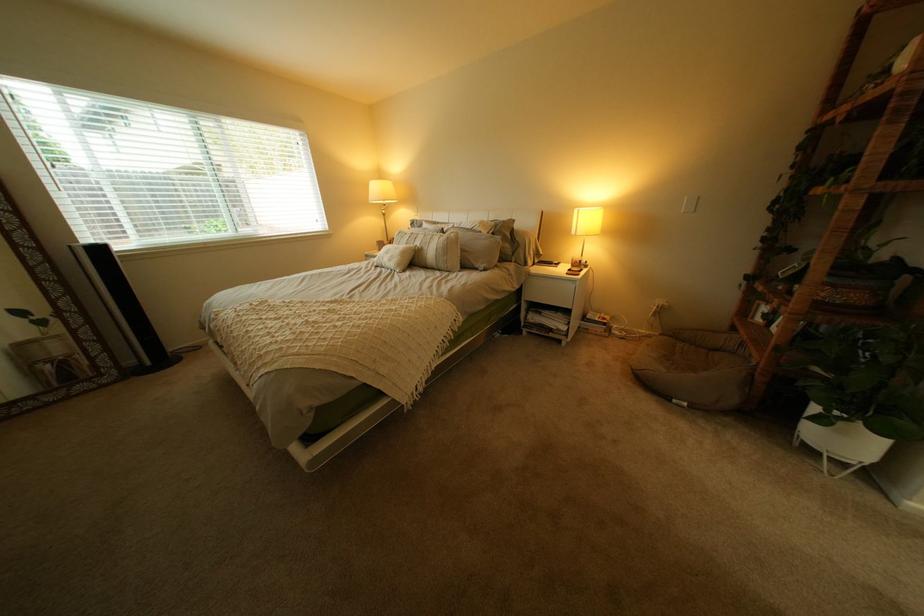
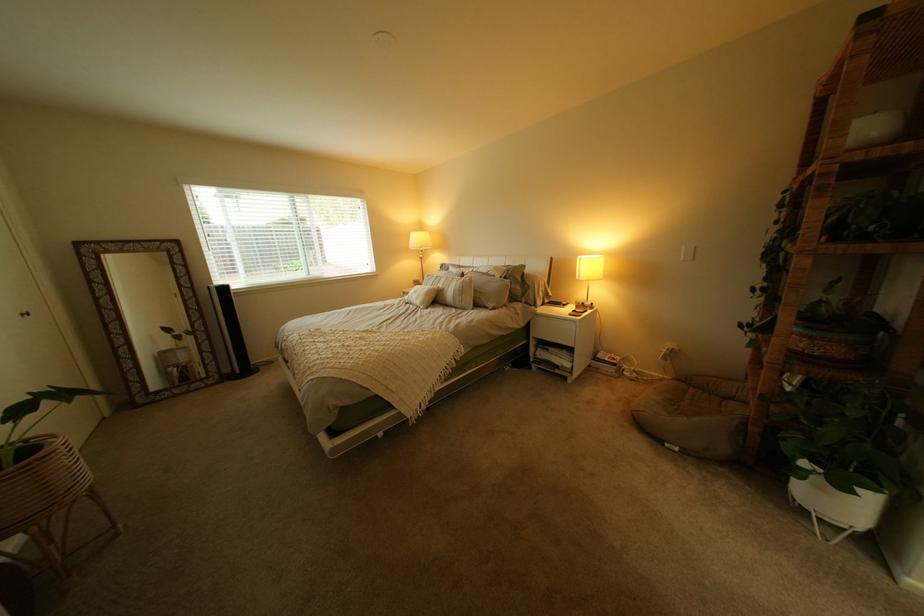
Where in the second image is the point corresponding to [824,451] from the first image?

(821, 512)